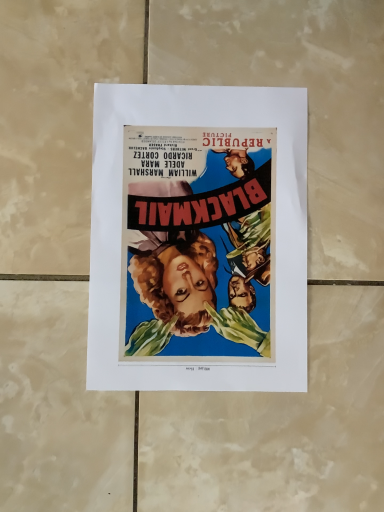
Question: In which direction should I rotate to look at watercolor painting of a movie poster at center?

Choices:
 (A) right
 (B) left

Answer: (A)